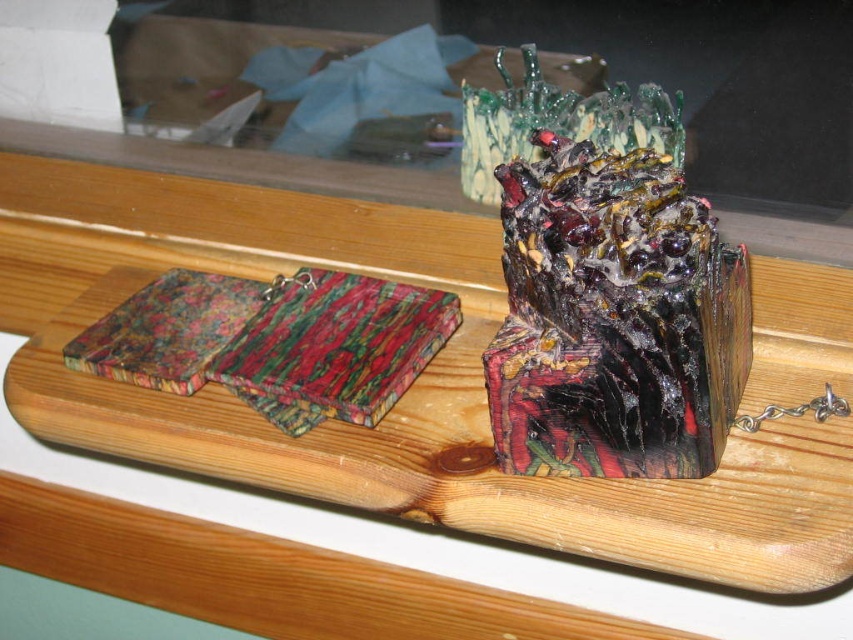
Question: Can you confirm if glossy resin cube at center is thinner than multicolored resin at center?

Choices:
 (A) no
 (B) yes

Answer: (A)

Question: Among these objects, which one is farthest from the camera?

Choices:
 (A) multicolored resin at center
 (B) marbled wood coaster at left
 (C) glossy resin cube at center

Answer: (B)

Question: Which object appears farthest from the camera in this image?

Choices:
 (A) marbled wood coaster at left
 (B) wooden tray at center
 (C) multicolored resin at center
 (D) glossy resin cube at center

Answer: (A)

Question: Is wooden tray at center thinner than multicolored resin at center?

Choices:
 (A) no
 (B) yes

Answer: (A)

Question: Can you confirm if glossy resin cube at center is wider than marbled wood coaster at left?

Choices:
 (A) yes
 (B) no

Answer: (A)

Question: Considering the real-world distances, which object is farthest from the wooden tray at center?

Choices:
 (A) glossy resin cube at center
 (B) multicolored resin at center

Answer: (A)